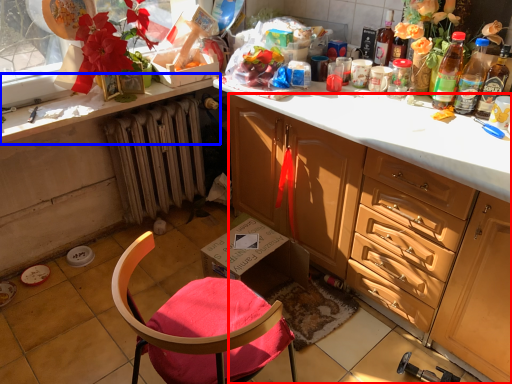
Question: Which object is closer to the camera taking this photo, cabinetry (highlighted by a red box) or countertop (highlighted by a blue box)?

Choices:
 (A) cabinetry
 (B) countertop

Answer: (A)